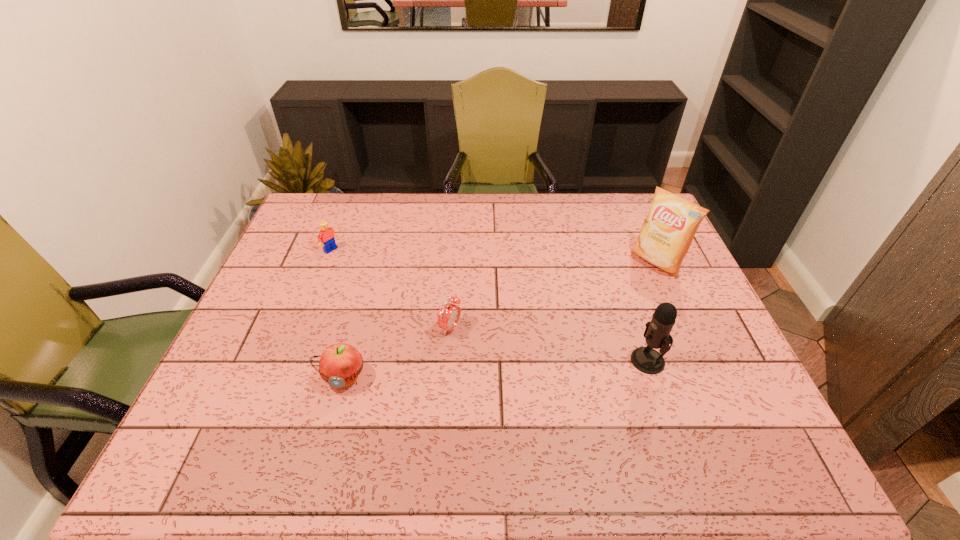
Locate an element on the screen. empty space between the fourth object from right to left and the Lego is located at coordinates (337, 313).

At what (x,y) coordinates should I click in order to perform the action: click on free spot between the fourth object from right to left and the microphone. Please return your answer as a coordinate pair (x, y). The image size is (960, 540). Looking at the image, I should click on [x=496, y=369].

Locate an element on the screen. The width and height of the screenshot is (960, 540). unoccupied area between the fourth object from right to left and the leftmost object is located at coordinates (337, 313).

Where is `vacant space in between the rightmost object and the alarm clock`? The image size is (960, 540). vacant space in between the rightmost object and the alarm clock is located at coordinates (553, 295).

Find the location of a particular element. The image size is (960, 540). vacant area that lies between the second object from right to left and the apple is located at coordinates (496, 369).

The height and width of the screenshot is (540, 960). In order to click on free spot between the apple and the leftmost object in this screenshot , I will do `click(337, 313)`.

Locate an element on the screen. The width and height of the screenshot is (960, 540). the fourth closest object to the leftmost object is located at coordinates (667, 233).

Identify the location of object that ranks as the closest to the alarm clock. The image size is (960, 540). (340, 364).

Identify the location of vacant space that satisfies the following two spatial constraints: 1. on the back side of the rightmost object; 2. on the right side of the second object from right to left. This screenshot has width=960, height=540. (614, 261).